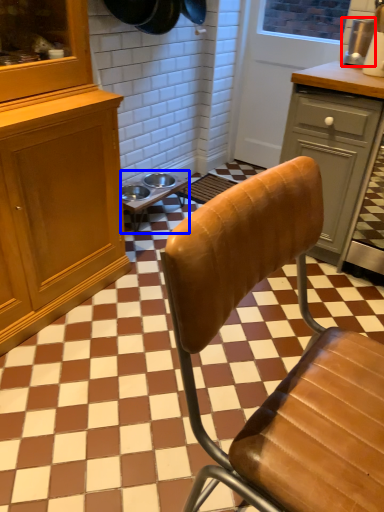
Question: Which point is further to the camera, appliance (highlighted by a red box) or table (highlighted by a blue box)?

Choices:
 (A) appliance
 (B) table

Answer: (B)